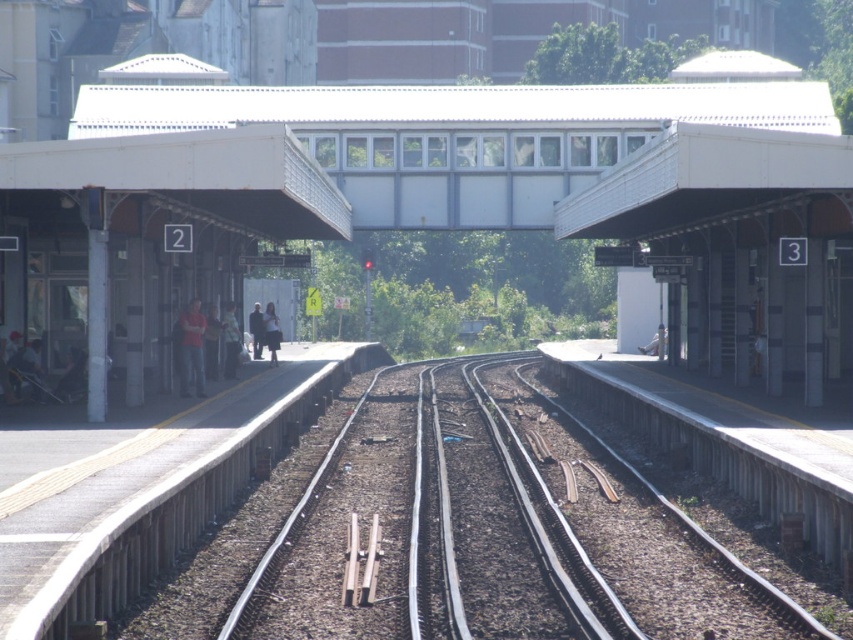
Question: Among these objects, which one is nearest to the camera?

Choices:
 (A) light blue denim jacket at left
 (B) smooth concrete train track at center

Answer: (B)

Question: Can you confirm if dark blue jeans at center is positioned below dark gray fabric jacket at left?

Choices:
 (A) yes
 (B) no

Answer: (A)

Question: Based on their relative distances, which object is farther from the dark gray fabric jacket at left?

Choices:
 (A) matte red shirt at left
 (B) light blue denim jacket at left
 (C) dark blue jeans at center

Answer: (A)

Question: Can you confirm if concrete platform at left is wider than dark gray fabric jacket at left?

Choices:
 (A) no
 (B) yes

Answer: (A)

Question: Which is farther from the red fabric jacket at left?

Choices:
 (A) dark blue jeans at center
 (B) smooth concrete train track at center

Answer: (B)

Question: Can you confirm if smooth concrete train track at center is bigger than matte red shirt at left?

Choices:
 (A) yes
 (B) no

Answer: (A)